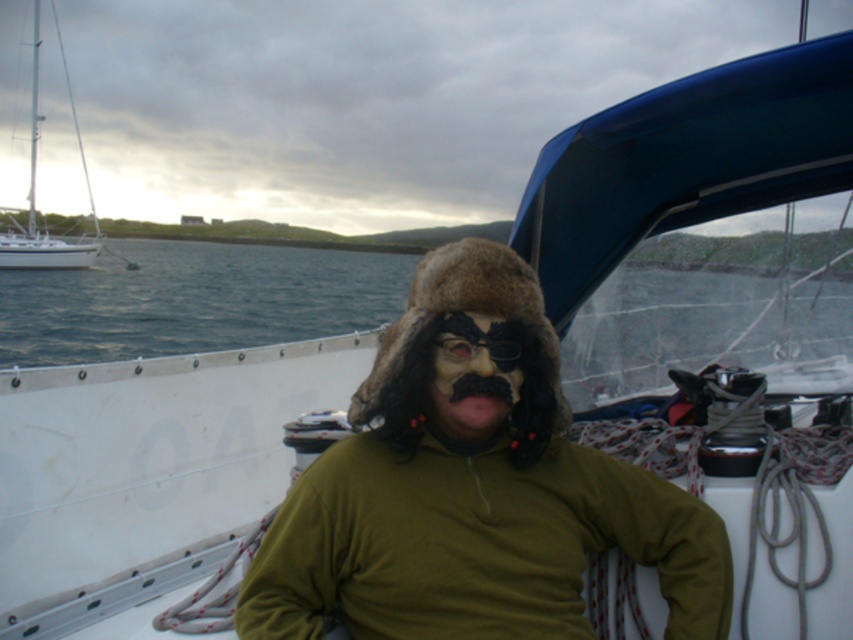
You are a photographer on a nearby boat trying to capture a photo of the brown fur hat at center and the white glossy sailboat at left in the same frame. Given that your camera has a maximum focus range of 30 meters, will you be able to capture both objects in focus?

The distance between the brown fur hat at center and the white glossy sailboat at left is 35.25 meters, which exceeds the camera maximum focus range of 30 meters. Therefore, you cannot capture both objects in focus.

You are a photographer on a nearby boat and want to capture both the brown fur hat at center and the white glossy sailboat at left in a single shot. Based on their heights, which object will appear smaller in your photo?

The brown fur hat at center will appear smaller in the photo because it has a lesser height compared to the white glossy sailboat at left.

You are a photographer on the deck of the sailboat and want to capture a closeup shot of both the brown fur hat at center and the brown fur nose at center in the same frame. Given their sizes, which object should you zoom in on more to ensure both fit properly?

Since the brown fur hat at center is wider than the brown fur nose at center, you should zoom in more on the brown fur nose at center to accommodate the larger size of the hat in the frame.